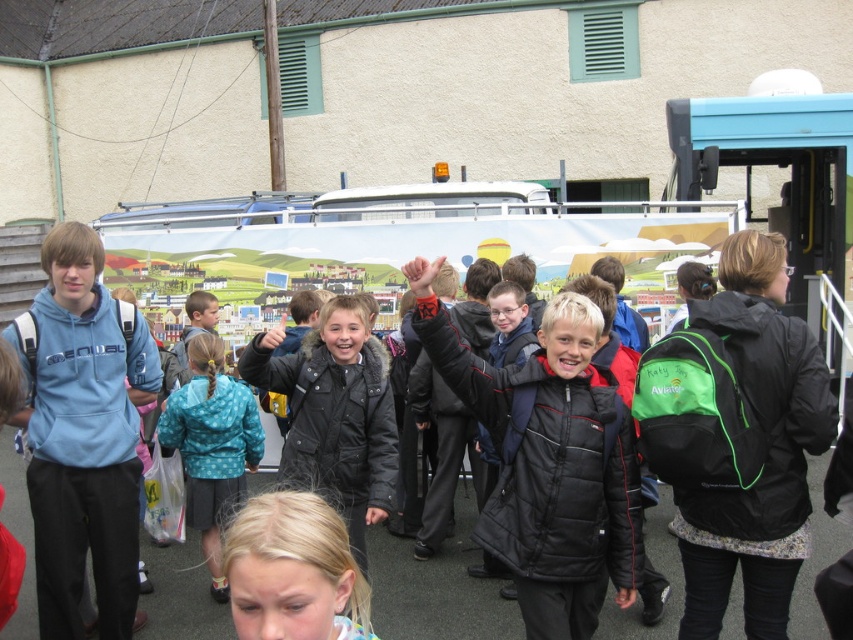
You are a photographer standing at the center of the image. You want to capture a photo of the black matte backpack at right. Based on its coordinates, where should you point your camera?

The black matte backpack at right is located at coordinates point (737, 436), so you should point your camera towards the right side of the image, specifically at the position marked by those coordinates to capture it.

You are a photographer trying to capture a photo of the blonde hair at lower center without including the black matte backpack at right in the frame. Based on their positions, is this possible?

The black matte backpack at right is to the right of blonde hair at lower center, so if you position yourself to the left side of the scene, you can frame the blonde hair at lower center while excluding the backpack on the right.